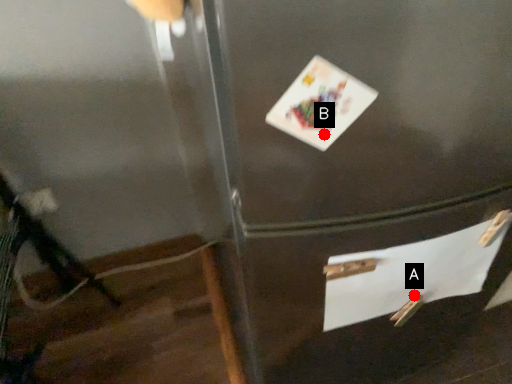
Question: Two points are circled on the image, labeled by A and B beside each circle. Among these points, which one is farthest from the camera?

Choices:
 (A) A is further
 (B) B is further

Answer: (A)